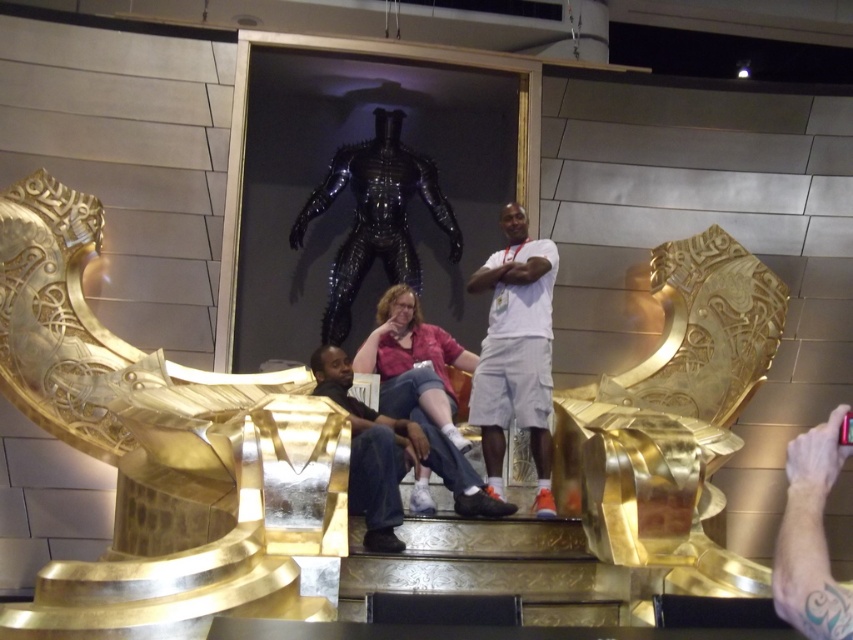
You are attending a costume party and see a person wearing the matte pink shirt at center and matte black pants at center. If you want to take a photo of their outfit from the front, which part should you focus on first to capture the entire outfit in the frame?

You should focus on the matte black pants at center first because the matte pink shirt at center is above it, ensuring the lower part of the outfit is centered before adjusting for the upper part.